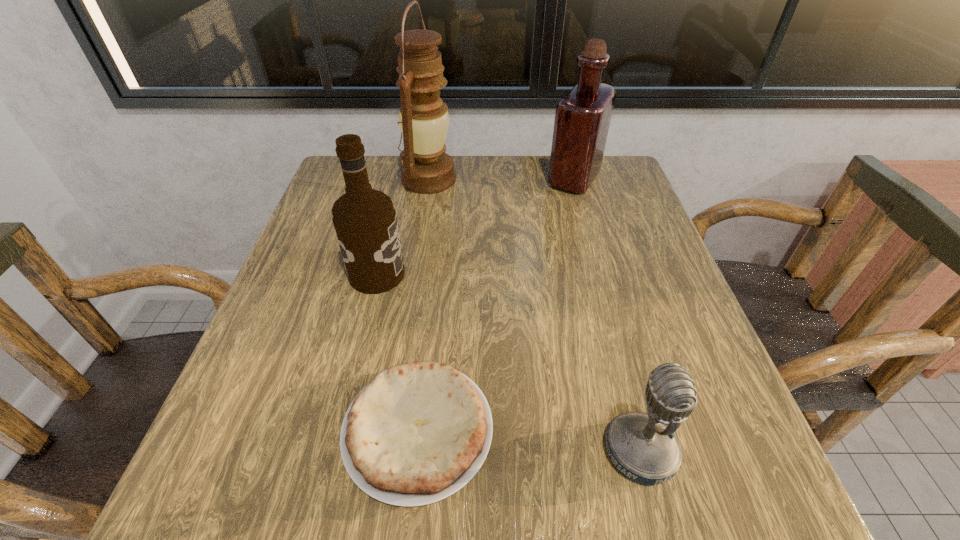
Locate an element on the screen. unoccupied position between the tortilla and the liquor is located at coordinates (496, 305).

Locate an element on the screen. Image resolution: width=960 pixels, height=540 pixels. free space between the oil lamp and the shortest object is located at coordinates tap(423, 305).

Identify the location of vacant area between the liquor and the third farthest object. (475, 227).

The image size is (960, 540). Find the location of `vacant point located between the oil lamp and the shortest object`. vacant point located between the oil lamp and the shortest object is located at coordinates coord(423,305).

Image resolution: width=960 pixels, height=540 pixels. Identify the location of blank region between the oil lamp and the liquor. (501, 179).

I want to click on free spot between the tortilla and the liquor, so pyautogui.click(x=496, y=305).

I want to click on vacant space that is in between the microphone and the third farthest object, so click(509, 363).

This screenshot has height=540, width=960. What are the coordinates of `free spot between the tortilla and the oil lamp` in the screenshot? It's located at click(423, 305).

Where is `object that stands as the second closest to the oil lamp`? The image size is (960, 540). object that stands as the second closest to the oil lamp is located at coordinates (582, 119).

Identify which object is located as the fourth nearest to the liquor. Please provide its 2D coordinates. Your answer should be formatted as a tuple, i.e. [(x, y)], where the tuple contains the x and y coordinates of a point satisfying the conditions above.

[(643, 447)]